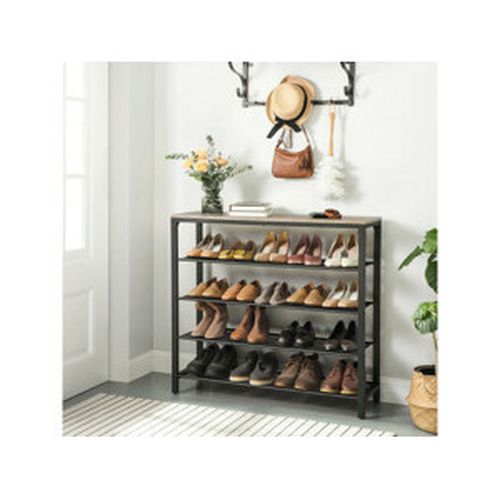
Identify the location of shoes on shelf below top shelf. This screenshot has height=500, width=500. (196, 288), (211, 290), (230, 293), (243, 293), (263, 294), (279, 297), (297, 293), (310, 296), (330, 300), (344, 302).